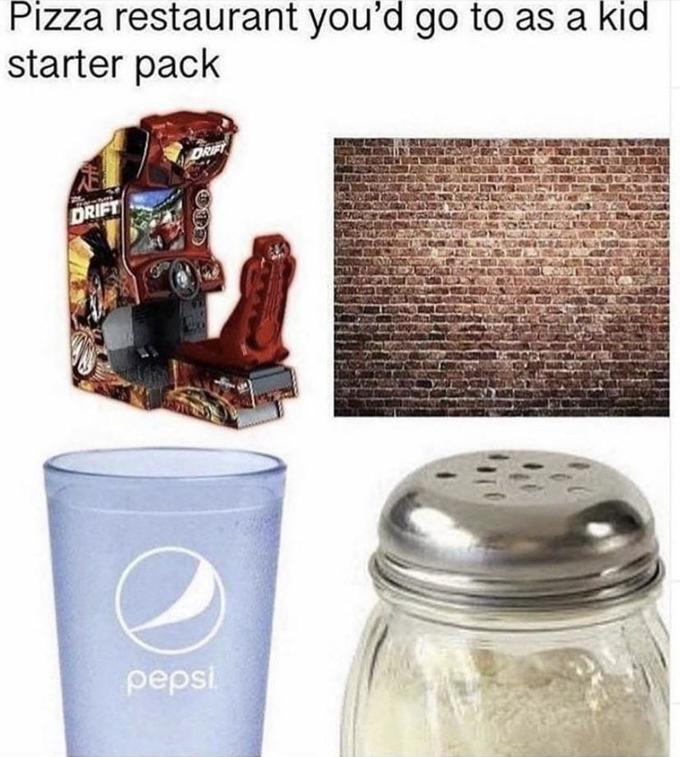
Identify the location of bluish plastic cup with pepsi and pepsi logo. [x=228, y=658].